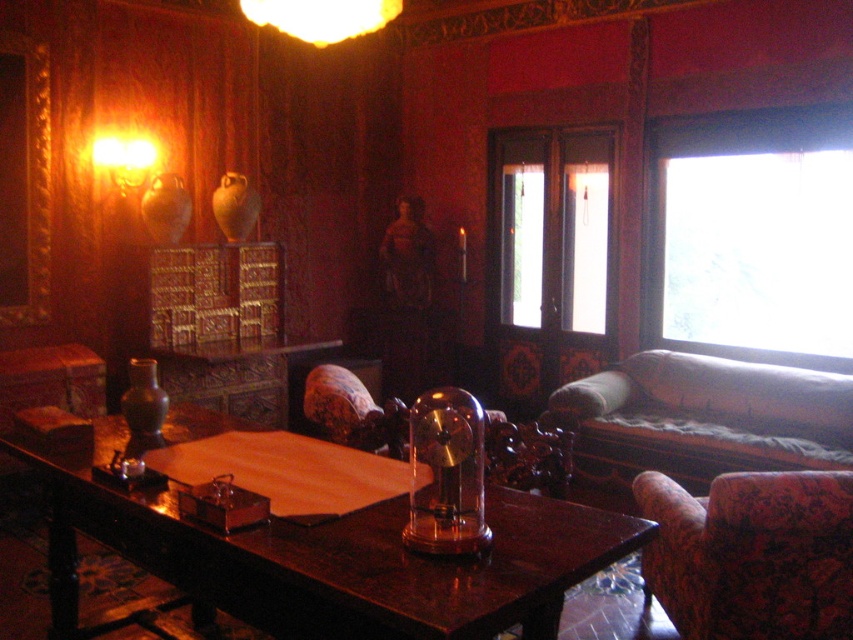
Does shiny dark wood table at center have a lesser width compared to velvet beige couch at right?

In fact, shiny dark wood table at center might be wider than velvet beige couch at right.

Between shiny dark wood table at center and velvet beige couch at right, which one is positioned higher?

Positioned higher is velvet beige couch at right.

Which is in front, point (546, 589) or point (677, 464)?

Point (546, 589)

Identify the location of shiny dark wood table at center. This screenshot has height=640, width=853. 329,557.

Which is more to the left, velvet beige couch at right or matte gold lampshade at upper center?

From the viewer's perspective, matte gold lampshade at upper center appears more on the left side.

Who is shorter, velvet beige couch at right or matte gold lampshade at upper center?

With less height is matte gold lampshade at upper center.

Between point (827, 422) and point (384, 3), which one is positioned in front?

Positioned in front is point (384, 3).

Find the location of a particular element. The image size is (853, 640). velvet beige couch at right is located at coordinates (705, 417).

Is point (462, 627) less distant than point (113, 166)?

That is True.

Measure the distance between point (585, 554) and camera.

They are 1.86 meters apart.

Which is behind, point (67, 518) or point (120, 189)?

The point (120, 189) is behind.

Image resolution: width=853 pixels, height=640 pixels. In order to click on shiny dark wood table at center in this screenshot , I will do `click(329, 557)`.